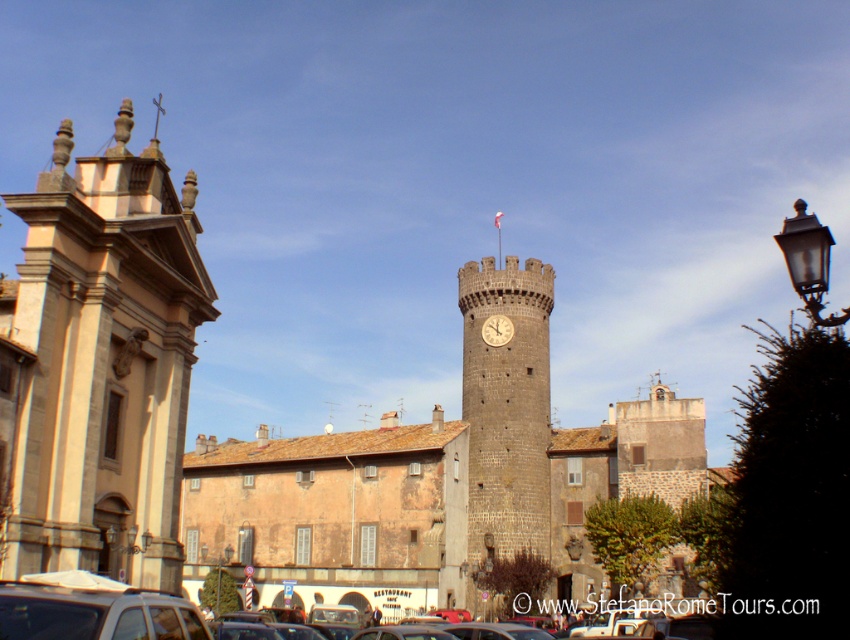
You are standing in the square and want to take a photo of both the beige stone tower at left and the gold metallic clock at center. Which object should you position closer to the camera to include both in the frame?

Since the beige stone tower at left is closer to the viewer than the gold metallic clock at center, you should position the camera closer to the beige stone tower at left to ensure both are in the frame.

You are standing in the urban scene and want to take a photo of the beige stone tower at left. If your camera has a maximum focus range of 40 meters, will you need to move closer to capture it clearly?

The beige stone tower at left is 42.65 meters away from the viewer, which exceeds the camera maximum focus range of 40 meters. You need to move closer to ensure the camera can focus on it properly.